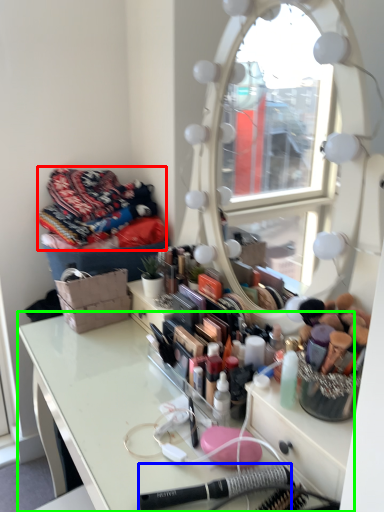
Question: Considering the real-world distances, which object is farthest from clothing (highlighted by a red box)? equipment (highlighted by a blue box) or table (highlighted by a green box)?

Choices:
 (A) equipment
 (B) table

Answer: (A)